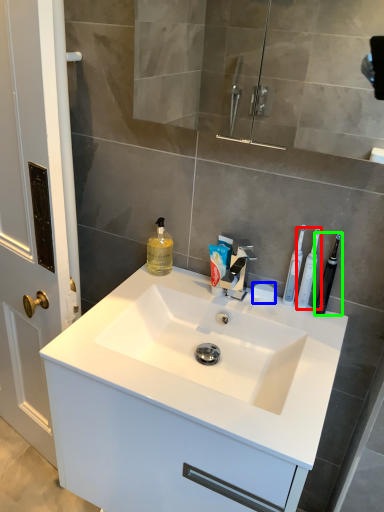
Question: Estimate the real-world distances between objects in this image. Which object is farther from toothbrush (highlighted by a red box), soap (highlighted by a blue box) or toothbrush (highlighted by a green box)?

Choices:
 (A) soap
 (B) toothbrush

Answer: (A)